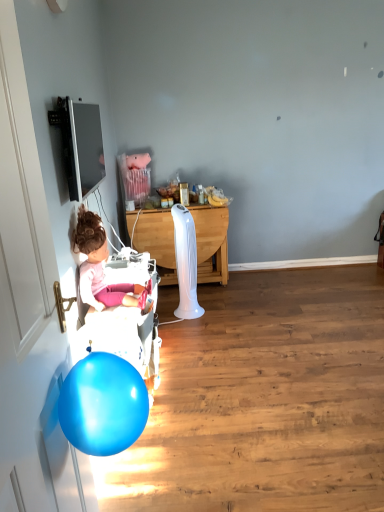
Question: Is matte pink doll at left completely or partially inside white glossy door at left?

Choices:
 (A) yes
 (B) no

Answer: (B)

Question: Considering the relative sizes of white glossy door at left and matte pink doll at left in the image provided, is white glossy door at left bigger than matte pink doll at left?

Choices:
 (A) no
 (B) yes

Answer: (B)

Question: Does white glossy door at left lie in front of matte pink doll at left?

Choices:
 (A) no
 (B) yes

Answer: (B)

Question: Does white glossy door at left have a greater width compared to matte pink doll at left?

Choices:
 (A) no
 (B) yes

Answer: (A)

Question: Is white glossy door at left looking in the opposite direction of matte pink doll at left?

Choices:
 (A) yes
 (B) no

Answer: (B)

Question: From the image's perspective, is white glossy door at left above or below white plastic baby carriage at left?

Choices:
 (A) below
 (B) above

Answer: (B)

Question: In the image, is white glossy door at left on the left side or the right side of white plastic baby carriage at left?

Choices:
 (A) left
 (B) right

Answer: (A)

Question: Do you think white glossy door at left is within white plastic baby carriage at left, or outside of it?

Choices:
 (A) outside
 (B) inside

Answer: (A)

Question: Considering the positions of white glossy door at left and white plastic baby carriage at left in the image, is white glossy door at left taller or shorter than white plastic baby carriage at left?

Choices:
 (A) short
 (B) tall

Answer: (B)

Question: Does point (94, 335) appear closer or farther from the camera than point (201, 208)?

Choices:
 (A) farther
 (B) closer

Answer: (B)

Question: In terms of height, does white plastic baby carriage at left look taller or shorter compared to white wood desk at center?

Choices:
 (A) short
 (B) tall

Answer: (A)

Question: Based on their positions, is white plastic baby carriage at left located to the left or right of white wood desk at center?

Choices:
 (A) right
 (B) left

Answer: (B)

Question: Is white plastic baby carriage at left in front of or behind white wood desk at center in the image?

Choices:
 (A) behind
 (B) front

Answer: (B)

Question: Do you think white wood desk at center is within matte pink doll at left, or outside of it?

Choices:
 (A) inside
 (B) outside

Answer: (B)

Question: Is point (208, 279) closer or farther from the camera than point (140, 306)?

Choices:
 (A) closer
 (B) farther

Answer: (B)